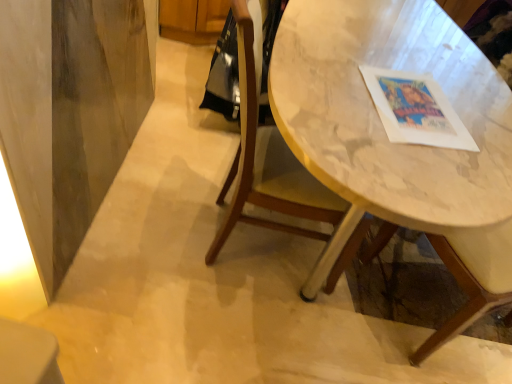
Question: Could marble table at center be considered to be inside wooden chair at center?

Choices:
 (A) yes
 (B) no

Answer: (B)

Question: Considering the relative sizes of wooden chair at center and marble table at center in the image provided, is wooden chair at center thinner than marble table at center?

Choices:
 (A) no
 (B) yes

Answer: (B)

Question: Is wooden chair at center positioned far away from marble table at center?

Choices:
 (A) yes
 (B) no

Answer: (B)

Question: From the image's perspective, is wooden chair at center located beneath marble table at center?

Choices:
 (A) no
 (B) yes

Answer: (B)

Question: Is marble table at center at the back of wooden chair at center?

Choices:
 (A) no
 (B) yes

Answer: (B)

Question: Can you confirm if wooden chair at center is taller than marble table at center?

Choices:
 (A) no
 (B) yes

Answer: (B)

Question: Considering the relative sizes of marble table at center and wooden chair at center in the image provided, is marble table at center wider than wooden chair at center?

Choices:
 (A) no
 (B) yes

Answer: (B)

Question: Considering the relative sizes of marble table at center and wooden chair at center in the image provided, is marble table at center bigger than wooden chair at center?

Choices:
 (A) yes
 (B) no

Answer: (A)

Question: Is marble table at center directly adjacent to wooden chair at center?

Choices:
 (A) yes
 (B) no

Answer: (B)

Question: Does marble table at center have a lesser height compared to wooden chair at center?

Choices:
 (A) no
 (B) yes

Answer: (B)

Question: Considering the relative positions of marble table at center and wooden chair at center in the image provided, is marble table at center to the left of wooden chair at center from the viewer's perspective?

Choices:
 (A) yes
 (B) no

Answer: (B)

Question: Is marble table at center completely or partially outside of wooden chair at center?

Choices:
 (A) yes
 (B) no

Answer: (A)

Question: Considering their positions, is marble table at center located in front of or behind wooden chair at center?

Choices:
 (A) front
 (B) behind

Answer: (A)